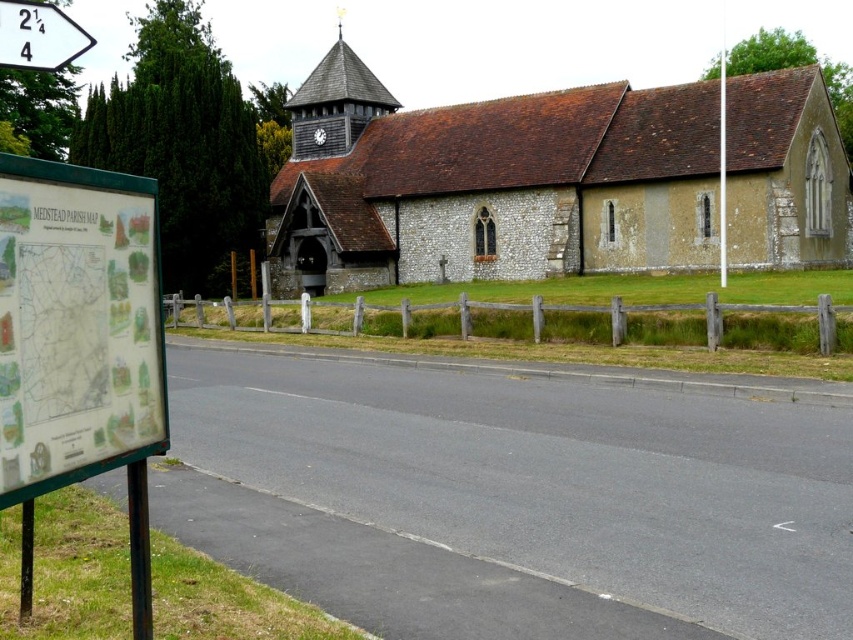
You are a tourist holding a map and looking at the brown stone church at center and the white plastic arrow at upper left. Which object is larger in the image?

The brown stone church at center is bigger than the white plastic arrow at upper left, so the brown stone church at center is larger in the image.

You are a tourist standing at the signpost and looking at the church. Which object is higher in the image, the wooden shingles spire at upper center or the white plastic arrow at upper left?

The wooden shingles spire at upper center is higher than the white plastic arrow at upper left in the image.